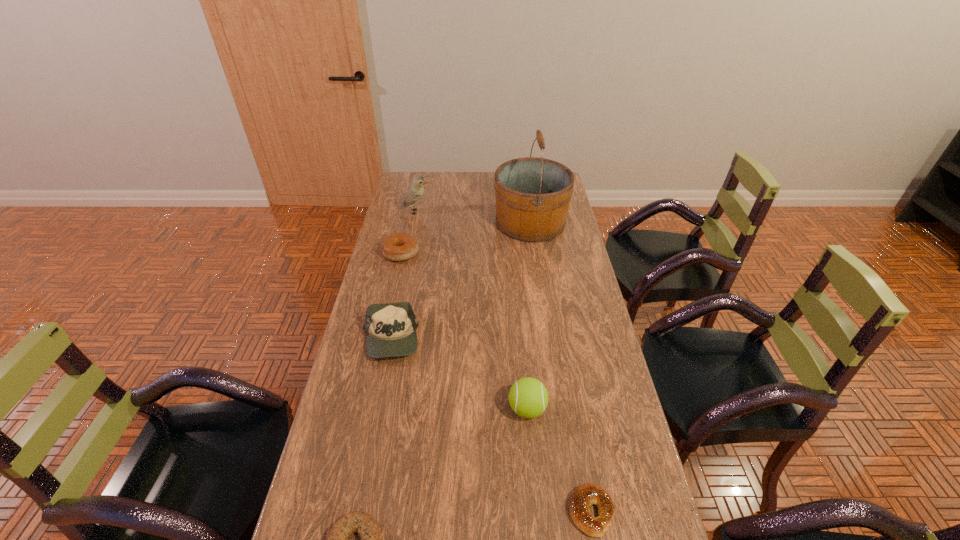
I want to click on vacant space at the far edge of the desktop, so click(x=430, y=196).

Find the location of a particular element. The height and width of the screenshot is (540, 960). vacant space at the left edge is located at coordinates (343, 509).

This screenshot has height=540, width=960. What are the coordinates of `vacant region at the right edge of the desktop` in the screenshot? It's located at (595, 316).

Locate an element on the screen. The image size is (960, 540). free spot between the rightmost bagel and the tallest bagel is located at coordinates (496, 382).

At what (x,y) coordinates should I click in order to perform the action: click on empty space that is in between the fourth nearest object and the fifth farthest object. Please return your answer as a coordinate pair (x, y). Image resolution: width=960 pixels, height=540 pixels. Looking at the image, I should click on (459, 374).

This screenshot has width=960, height=540. What are the coordinates of `free space between the third nearest object and the fourth nearest object` in the screenshot? It's located at (459, 374).

Image resolution: width=960 pixels, height=540 pixels. Identify the location of vacant space that is in between the fourth shortest object and the third tallest object. (459, 374).

Identify the location of vacant region between the second tallest object and the farthest bagel. (408, 233).

Find the location of a particular element. The height and width of the screenshot is (540, 960). vacant space in between the bucket and the farthest bagel is located at coordinates (466, 238).

I want to click on vacant space in between the fourth shortest object and the bucket, so click(460, 281).